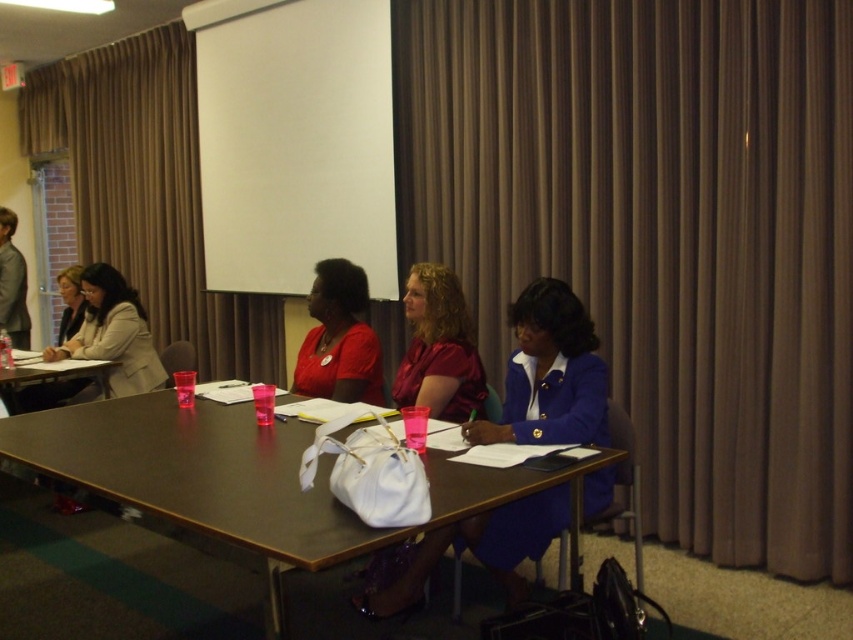
Question: Based on their relative distances, which object is nearer to the brown wooden table at center?

Choices:
 (A) brown fabric curtain at center
 (B) matte beige blazer at left
 (C) brown fabric curtain at upper center
 (D) matte red shirt at center

Answer: (D)

Question: Which point appears farthest from the camera in this image?

Choices:
 (A) (242, 516)
 (B) (83, 227)
 (C) (331, 378)

Answer: (B)

Question: Does brown wooden table at center appear on the left side of matte beige blazer at left?

Choices:
 (A) no
 (B) yes

Answer: (A)

Question: Is brown wooden table at center positioned behind blue satin blazer at center?

Choices:
 (A) yes
 (B) no

Answer: (B)

Question: Does shiny burgundy blouse at center come behind matte red shirt at center?

Choices:
 (A) yes
 (B) no

Answer: (B)

Question: Which object appears closest to the camera in this image?

Choices:
 (A) brown wooden table at center
 (B) blue satin blazer at center
 (C) matte red shirt at center

Answer: (A)